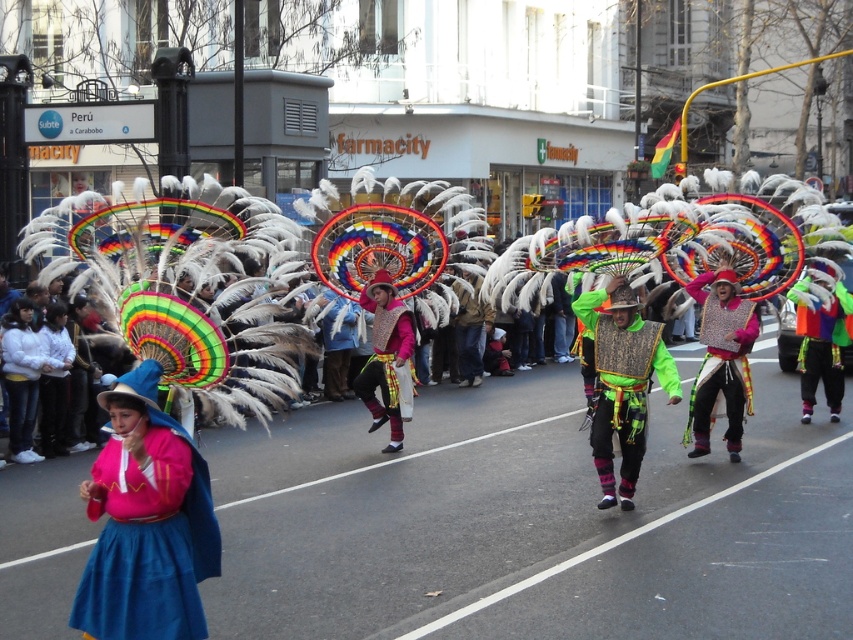
Is point (631, 340) farther from viewer compared to point (840, 289)?

No, it is not.

The image size is (853, 640). I want to click on green textured vest at center, so click(624, 384).

Who is taller, matte pink sweater at center or green textured vest at center?

green textured vest at center

Which is below, matte pink sweater at center or green textured vest at center?

matte pink sweater at center is below.

The width and height of the screenshot is (853, 640). Describe the element at coordinates (148, 524) in the screenshot. I see `matte pink sweater at center` at that location.

Where is `matte pink sweater at center`? matte pink sweater at center is located at coordinates (148, 524).

Can you confirm if matte pink sweater at center is shorter than metallic sequined vest at center?

Yes.

What do you see at coordinates (148, 524) in the screenshot? I see `matte pink sweater at center` at bounding box center [148, 524].

Find the location of a particular element. The image size is (853, 640). matte pink sweater at center is located at coordinates (148, 524).